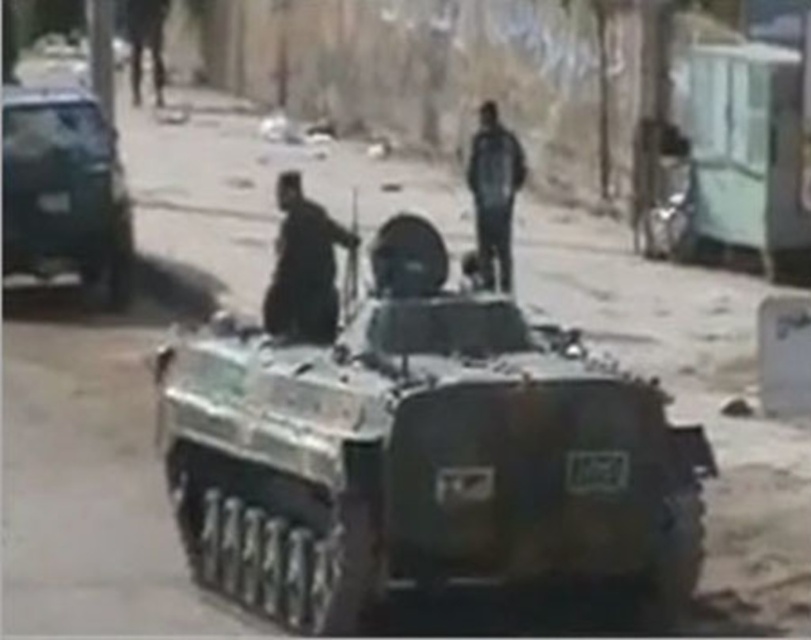
Question: Is shiny black car at left below dark blue fabric jacket at center?

Choices:
 (A) yes
 (B) no

Answer: (B)

Question: Which point is farther to the camera?

Choices:
 (A) (638, 492)
 (B) (488, 106)
 (C) (292, 224)

Answer: (B)

Question: Is camouflage-patterned tank at center positioned in front of shiny black car at left?

Choices:
 (A) yes
 (B) no

Answer: (A)

Question: Which of these objects is positioned closest to the shiny black car at left?

Choices:
 (A) dark blue fabric jacket at center
 (B) camouflage-patterned tank at center

Answer: (A)

Question: Can you confirm if camouflage-patterned tank at center is bigger than dark gray uniform at center?

Choices:
 (A) no
 (B) yes

Answer: (B)

Question: Which point is closer to the camera?

Choices:
 (A) dark blue fabric jacket at center
 (B) shiny black car at left
 (C) camouflage-patterned tank at center
 (D) dark gray uniform at center

Answer: (C)